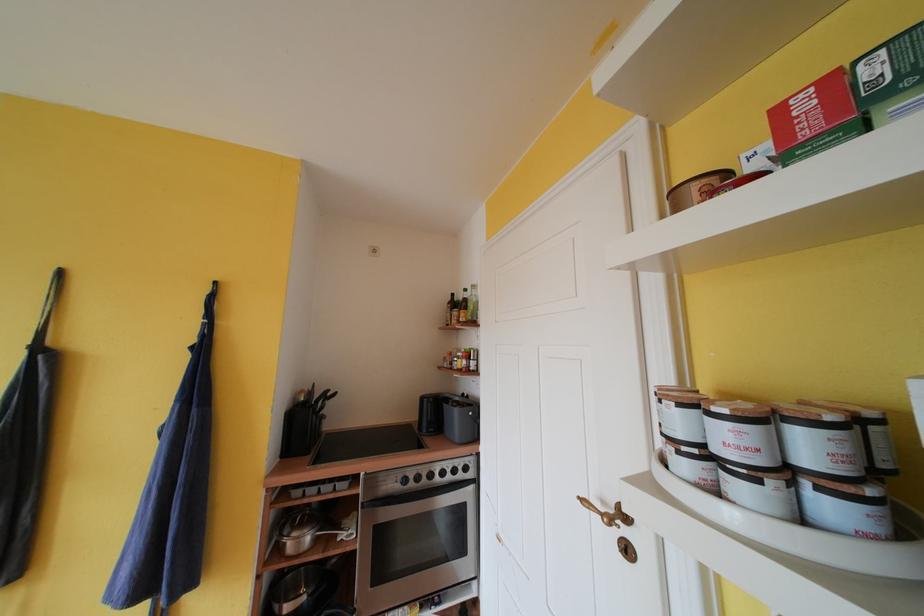
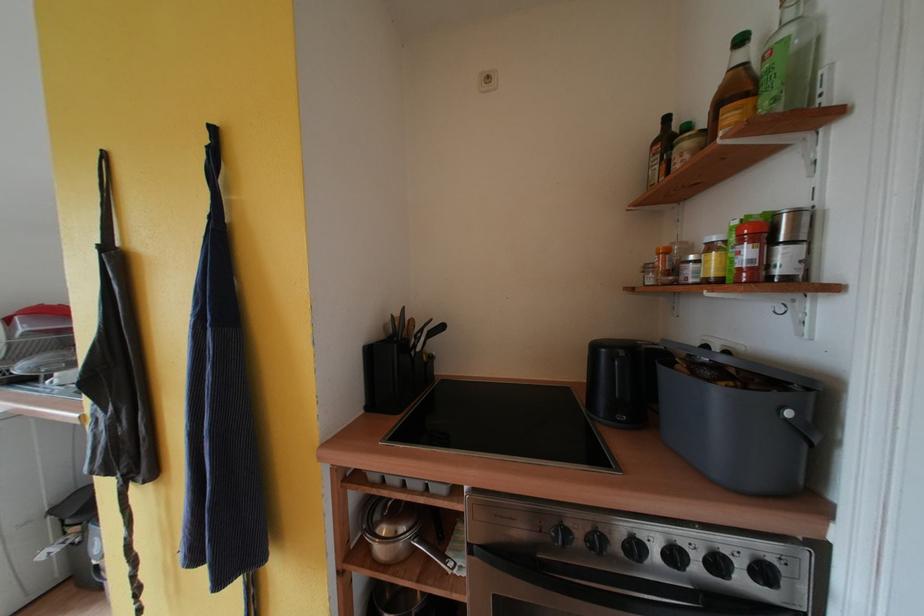
In the second image, find the point that corresponds to point (436, 479) in the first image.

(641, 551)